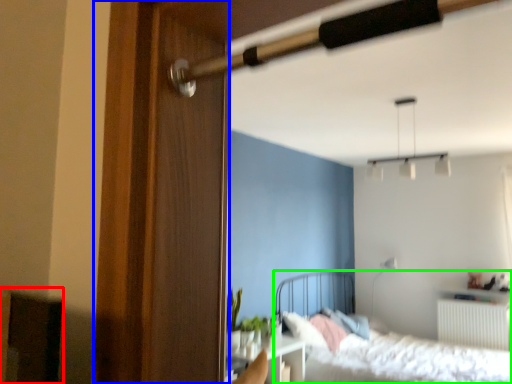
Question: Which is farther away from furniture (highlighted by a red box)? screen door (highlighted by a blue box) or bed (highlighted by a green box)?

Choices:
 (A) screen door
 (B) bed

Answer: (B)